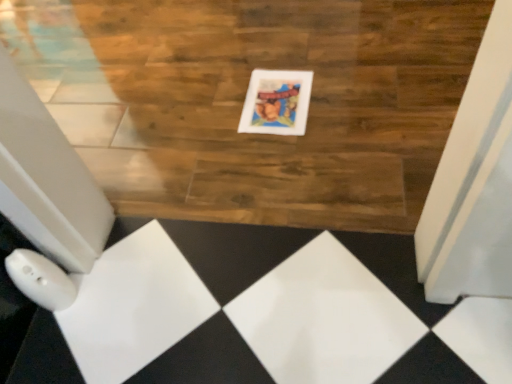
Locate an element on the screen. free location above wooden floor at center (from a real-world perspective) is located at coordinates (236, 91).